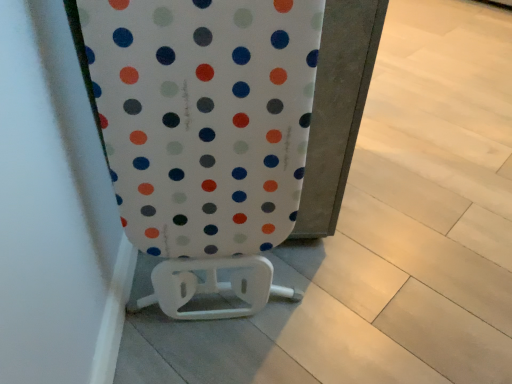
The width and height of the screenshot is (512, 384). What do you see at coordinates (205, 135) in the screenshot? I see `white plastic toilet at center` at bounding box center [205, 135].

The height and width of the screenshot is (384, 512). What are the coordinates of `white plastic toilet at center` in the screenshot? It's located at (205, 135).

Find the location of a particular element. white plastic toilet at center is located at coordinates (205, 135).